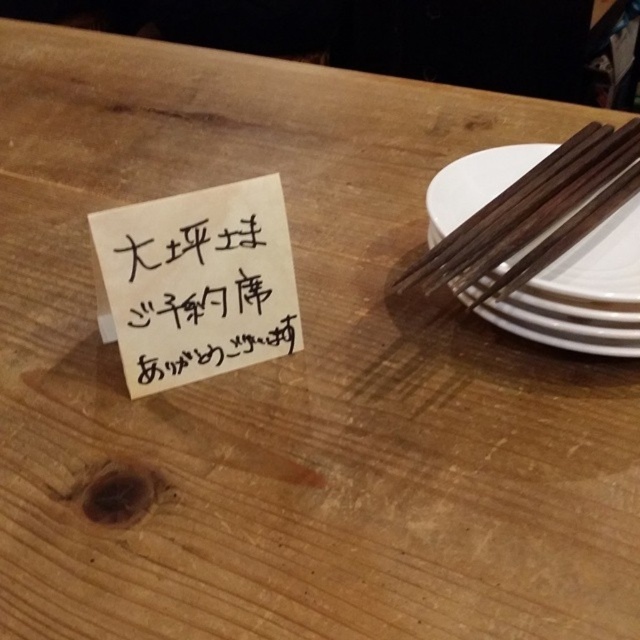
Question: In this image, where is white paper at upper left located relative to white glossy plate at right?

Choices:
 (A) below
 (B) above

Answer: (A)

Question: Is white paper at upper left to the right of white glossy plate at right from the viewer's perspective?

Choices:
 (A) no
 (B) yes

Answer: (A)

Question: Observing the image, what is the correct spatial positioning of white paper at upper left in reference to white glossy plate at right?

Choices:
 (A) left
 (B) right

Answer: (A)

Question: Which object is closer to the camera taking this photo?

Choices:
 (A) white paper at upper left
 (B) white glossy plate at right

Answer: (B)